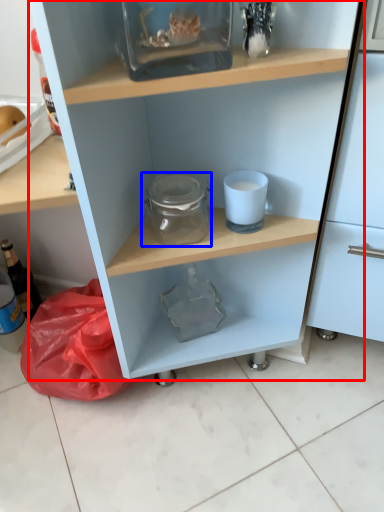
Question: Which object is closer to the camera taking this photo, shelf (highlighted by a red box) or glass jar (highlighted by a blue box)?

Choices:
 (A) shelf
 (B) glass jar

Answer: (A)